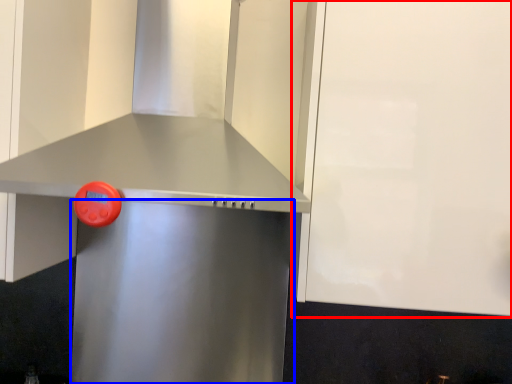
Question: Which object appears closest to the camera in this image, cabinetry (highlighted by a red box) or appliance (highlighted by a blue box)?

Choices:
 (A) cabinetry
 (B) appliance

Answer: (A)